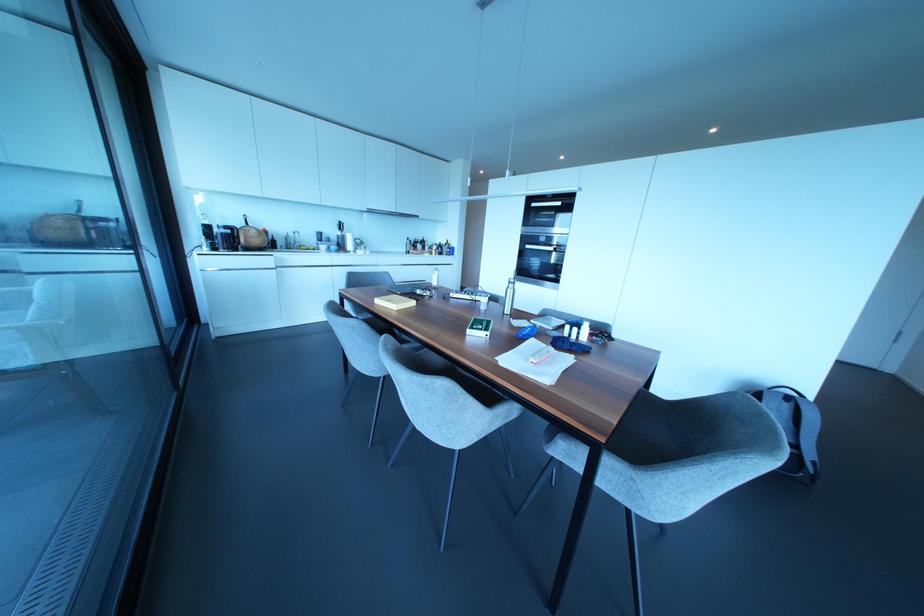
Locate an element on the screen. This screenshot has width=924, height=616. recessed cabinet handle is located at coordinates (391, 213).